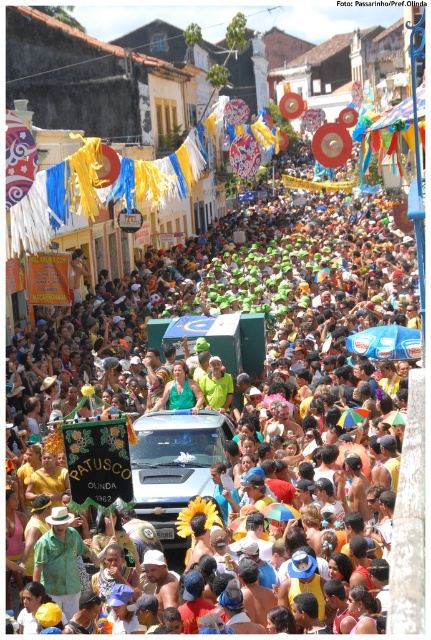
Which is behind, point (71, 422) or point (178, 371)?

Positioned behind is point (178, 371).

Can you confirm if multicolored fabric crowd at center is wider than green matte shirt at center?

Yes.

Measure the distance between point (169, 451) and camera.

40.77 meters

At what (x,y) coordinates should I click in order to perform the action: click on multicolored fabric crowd at center. Please return your answer as a coordinate pair (x, y). Looking at the image, I should click on (246, 314).